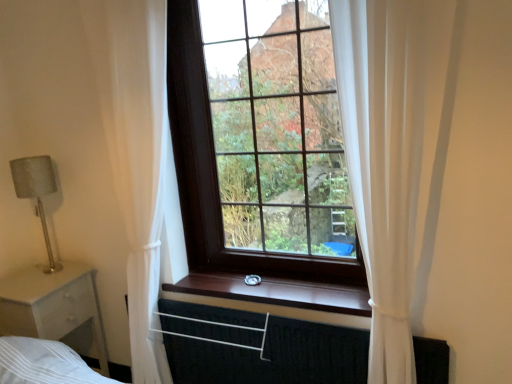
Question: Is black fabric canopy bed at lower center in front of white sheer curtain at left, acting as the second curtain starting from the right?

Choices:
 (A) yes
 (B) no

Answer: (B)

Question: From a real-world perspective, does black fabric canopy bed at lower center stand above white sheer curtain at left, acting as the second curtain starting from the right?

Choices:
 (A) no
 (B) yes

Answer: (A)

Question: Is white sheer curtain at left, which is counted as the 1th curtain, starting from the left, surrounded by black fabric canopy bed at lower center?

Choices:
 (A) yes
 (B) no

Answer: (B)

Question: Is black fabric canopy bed at lower center shorter than white sheer curtain at left, which is counted as the 1th curtain, starting from the left?

Choices:
 (A) yes
 (B) no

Answer: (A)

Question: Is black fabric canopy bed at lower center not within white sheer curtain at left, which is counted as the 1th curtain, starting from the left?

Choices:
 (A) yes
 (B) no

Answer: (B)

Question: Considering the relative sizes of black fabric canopy bed at lower center and white sheer curtain at left, which is counted as the 1th curtain, starting from the left, in the image provided, is black fabric canopy bed at lower center wider than white sheer curtain at left, which is counted as the 1th curtain, starting from the left,?

Choices:
 (A) yes
 (B) no

Answer: (B)

Question: From the image's perspective, is dark wood window at center above black fabric canopy bed at lower center?

Choices:
 (A) yes
 (B) no

Answer: (A)

Question: Does dark wood window at center come behind black fabric canopy bed at lower center?

Choices:
 (A) no
 (B) yes

Answer: (B)

Question: From a real-world perspective, is dark wood window at center physically below black fabric canopy bed at lower center?

Choices:
 (A) no
 (B) yes

Answer: (A)

Question: Is dark wood window at center bigger than black fabric canopy bed at lower center?

Choices:
 (A) yes
 (B) no

Answer: (A)

Question: Is dark wood window at center positioned beyond the bounds of black fabric canopy bed at lower center?

Choices:
 (A) yes
 (B) no

Answer: (A)

Question: Does dark wood window at center have a lesser height compared to black fabric canopy bed at lower center?

Choices:
 (A) yes
 (B) no

Answer: (B)

Question: From a real-world perspective, is black fabric canopy bed at lower center over wooden at center?

Choices:
 (A) yes
 (B) no

Answer: (B)